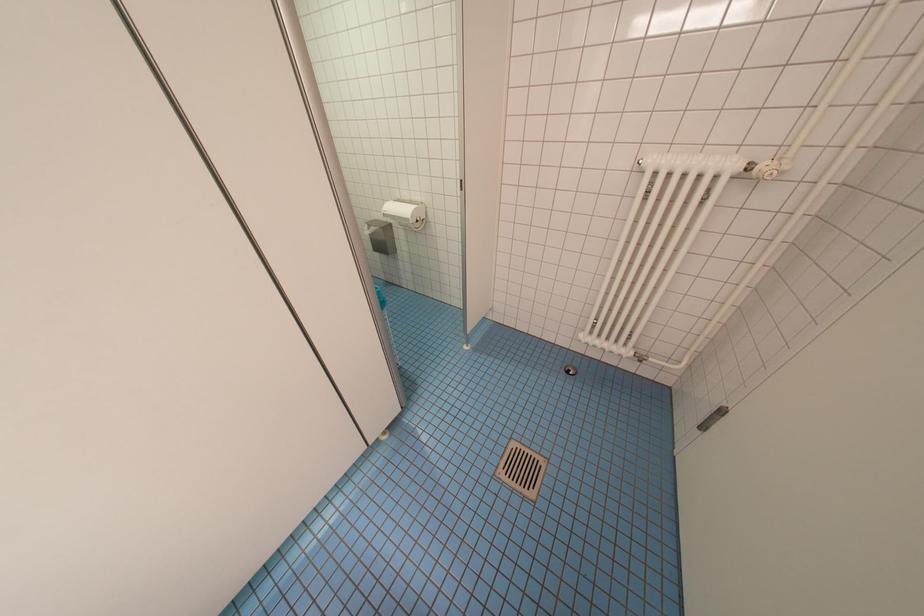
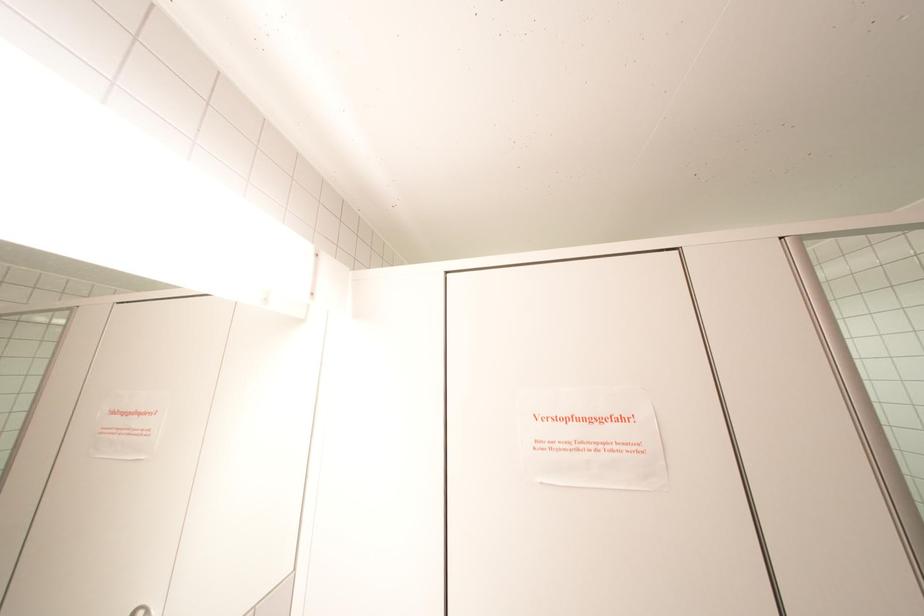
The first image is from the beginning of the video and the second image is from the end. How did the camera likely rotate when shooting the video?

The camera's rotation is toward left-up.